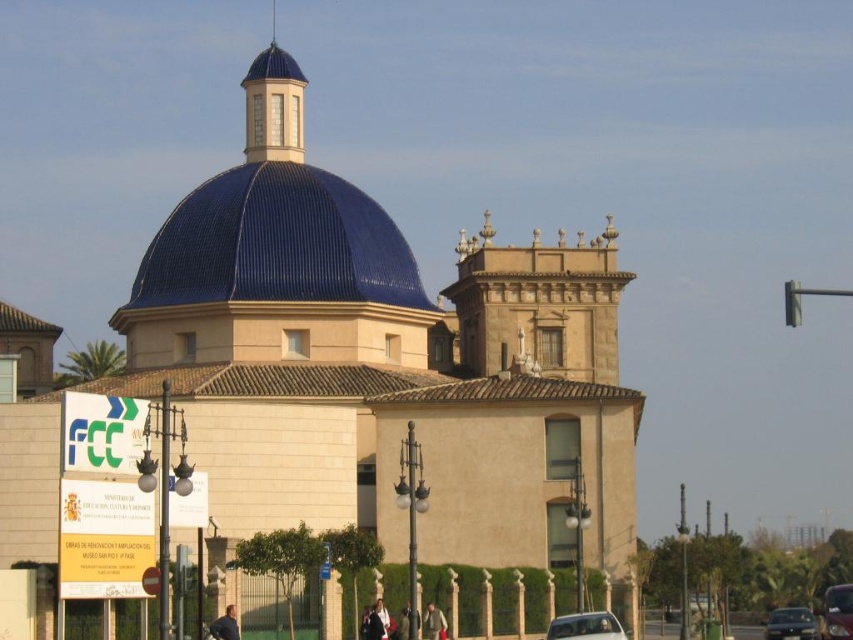
You are a visitor trying to park your car in the parking lot near the building. You see a white glossy car at lower center and a metallic silver car at lower right. Which car is closer to the entrance of the building?

The white glossy car at lower center is closer to the entrance of the building because it is positioned in front of the metallic silver car at lower right.

You are a photographer standing in front of the building. You want to capture a photo that includes both the blue ceramic dome at center and the white glossy car at lower center. Based on their positions, which object should appear higher in the photo?

The blue ceramic dome at center is above the white glossy car at lower center, so it will appear higher in the photo.